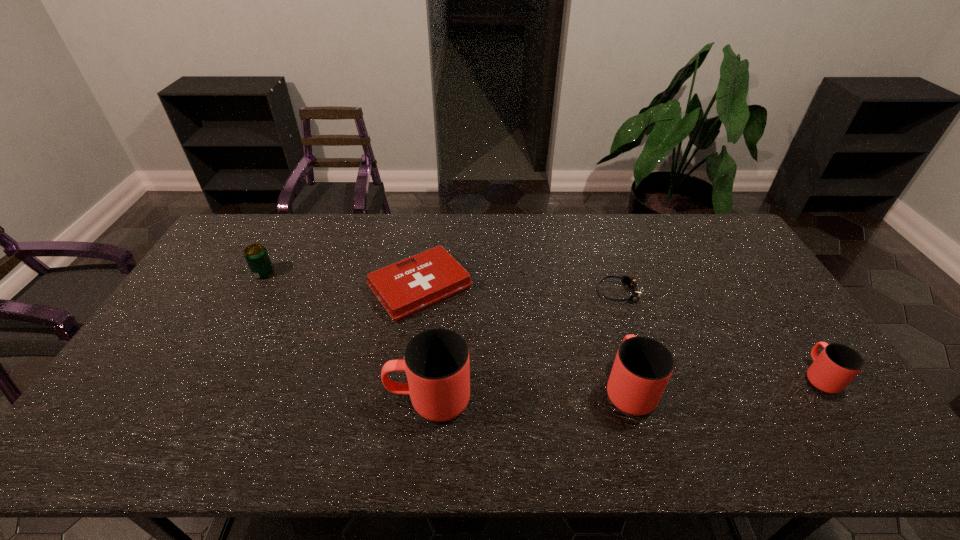
You are a GUI agent. You are given a task and a screenshot of the screen. Output one action in this format:
    pyautogui.click(x=<x>, y=<y>)
    Task: Click on the leftmost cup
    
    Given the screenshot: What is the action you would take?
    pyautogui.click(x=436, y=361)

Locate an element on the screen. The height and width of the screenshot is (540, 960). the second cup from right to left is located at coordinates (643, 366).

What are the coordinates of `the second tallest object` in the screenshot? It's located at (643, 366).

The height and width of the screenshot is (540, 960). Find the location of `the rightmost cup`. the rightmost cup is located at coordinates (837, 365).

Find the location of a particular element. This screenshot has height=540, width=960. the shortest cup is located at coordinates (837, 365).

Identify the location of beer can. Image resolution: width=960 pixels, height=540 pixels. (256, 255).

At what (x,y) coordinates should I click in order to perform the action: click on the first-aid kit. Please return your answer as a coordinate pair (x, y). Looking at the image, I should click on (432, 276).

Where is `goggles`? The image size is (960, 540). goggles is located at coordinates (630, 282).

The width and height of the screenshot is (960, 540). I want to click on free space located on the handle side of the leftmost cup, so click(x=259, y=399).

Find the location of a particular element. The image size is (960, 540). vacant space situated on the handle side of the leftmost cup is located at coordinates (272, 399).